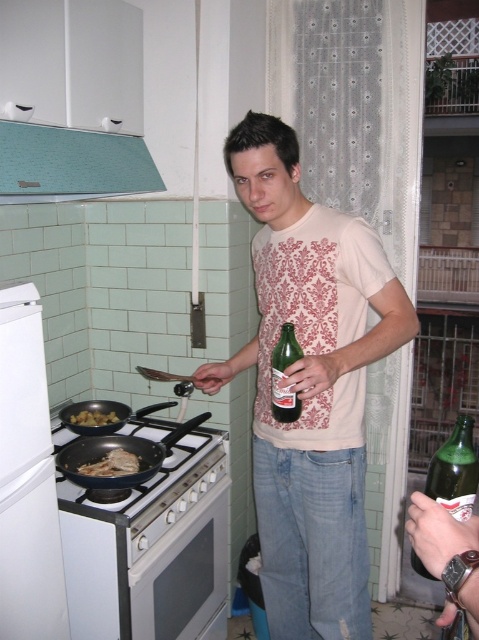
You are a home chef preparing a meal and need to place a tall baking dish on one of the appliances. Which appliance between the white glossy oven at lower center and the teal fabric exhaust hood at upper left would be suitable for placing the dish without it touching the ceiling?

The white glossy oven at lower center has a greater height compared to the teal fabric exhaust hood at upper left, so it would be suitable for placing the tall baking dish without it touching the ceiling.

You are a chef trying to reach both the green glass bottle at center and the brown crispy potato at stove. If your arm can extend 70 centimeters, can you grab both items without moving your position?

The distance between the green glass bottle at center and the brown crispy potato at stove is 88.21 centimeters. Since your arm can only extend 70 centimeters, you cannot reach both items without moving your position.

Where is the white matte refrigerator at left located in the scene?

The white matte refrigerator at left is located at point (26, 477) in the scene.